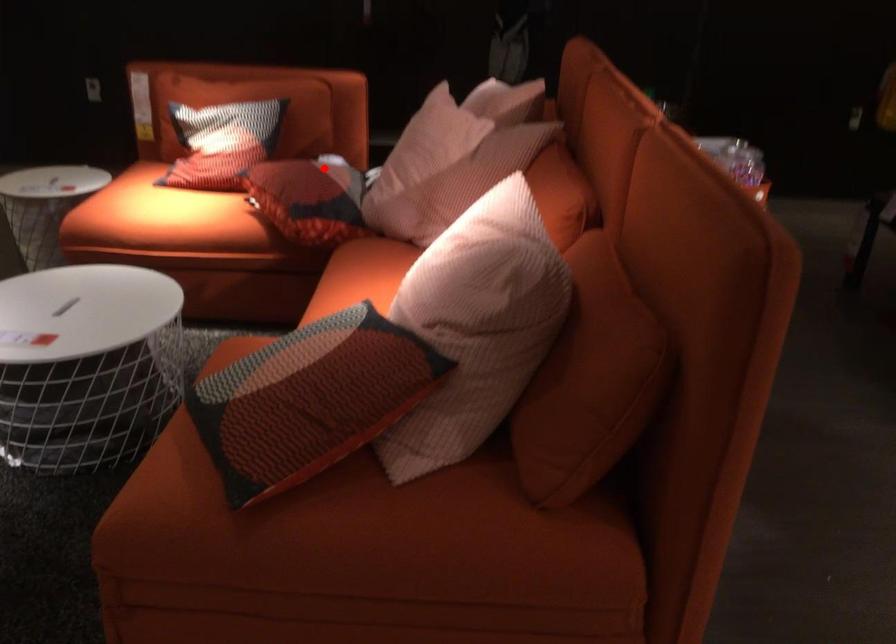
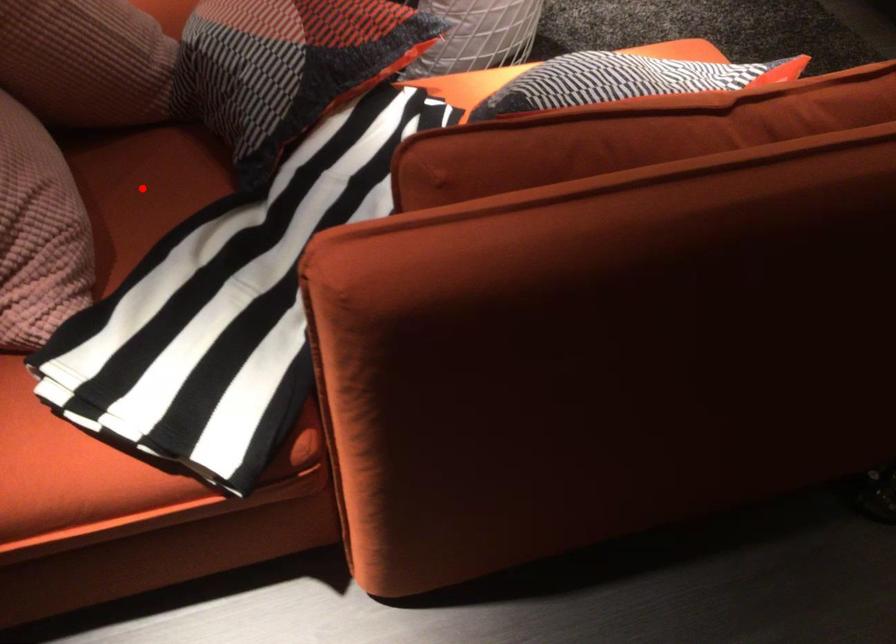
I am providing you with two images of the same scene from different viewpoints. A red point is marked on the first image and another point is marked on the second image. Do the highlighted points in image1 and image2 indicate the same real-world spot?

No